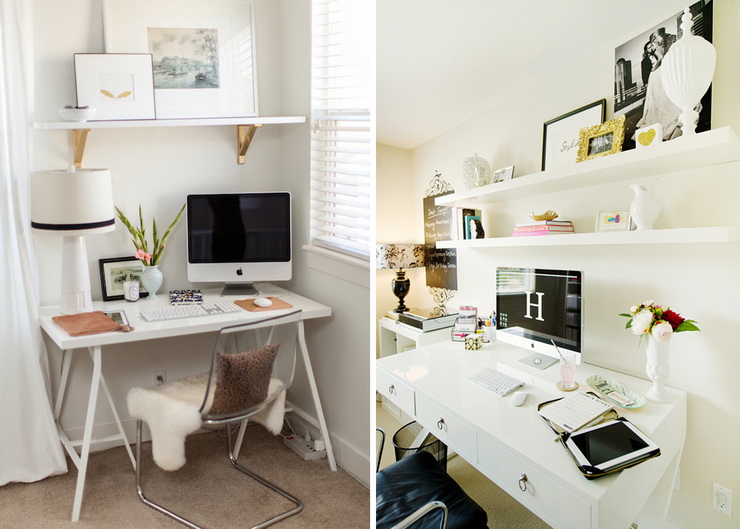
At what (x,y) coordinates should I click in order to perform the action: click on curtain. Please return your answer as a coordinate pair (x, y). This screenshot has height=529, width=740. Looking at the image, I should click on [x=23, y=415].